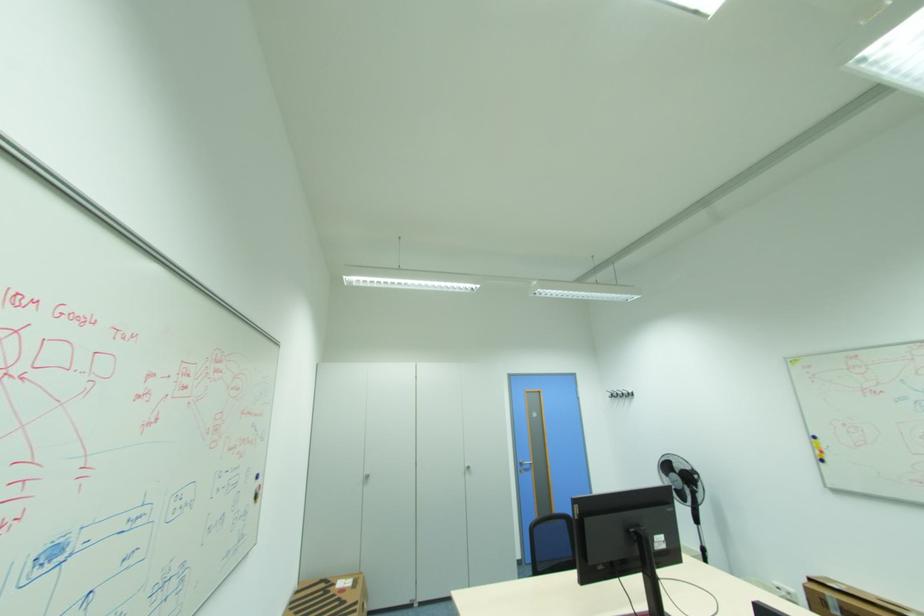
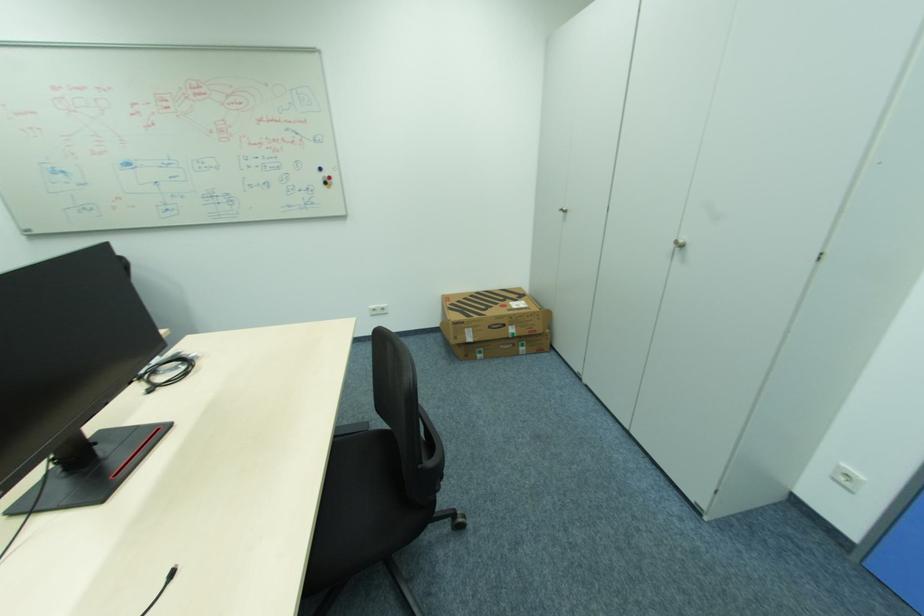
Locate, in the second image, the point that corresponds to (261,496) in the first image.

(331, 184)